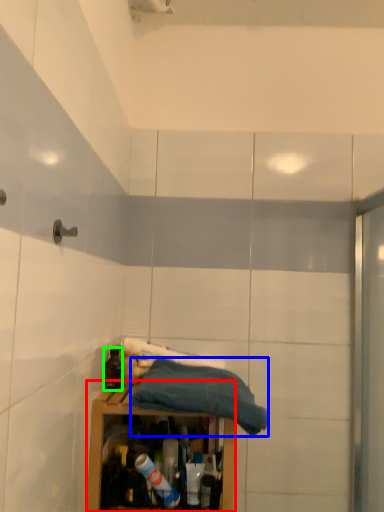
Question: Based on their relative distances, which object is nearer to cabinetry (highlighted by a red box)? Choose from towel (highlighted by a blue box) and bottle (highlighted by a green box).

Choices:
 (A) towel
 (B) bottle

Answer: (A)